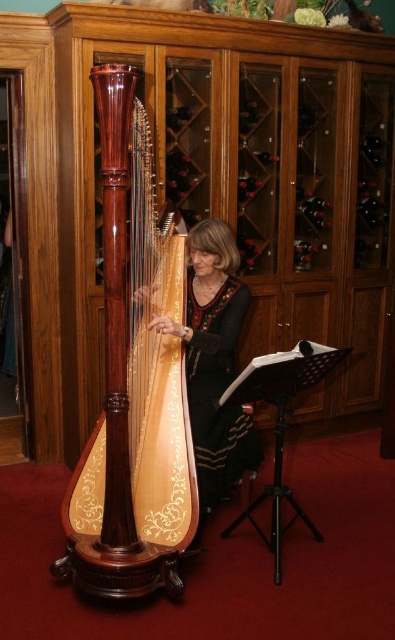
You are a stagehand setting up for a concert. You have two harps, the polished wood harp at center and the wooden harp at center. The stage has a narrow platform that can only accommodate a harp with a width of 1 meter. Which harp should you choose to fit on the platform?

The polished wood harp at center has a lesser width compared to the wooden harp at center, so you should choose the polished wood harp at center to fit on the platform since it is narrower than the wooden harp at center.

You are a photographer setting up for a concert. You need to place a spotlight on the polished wood harp at center and the wooden harp at center. According to the scene, which harp should you place the spotlight to the left of?

The polished wood harp at center is positioned on the left side of wooden harp at center, so you should place the spotlight to the left of the polished wood harp at center.